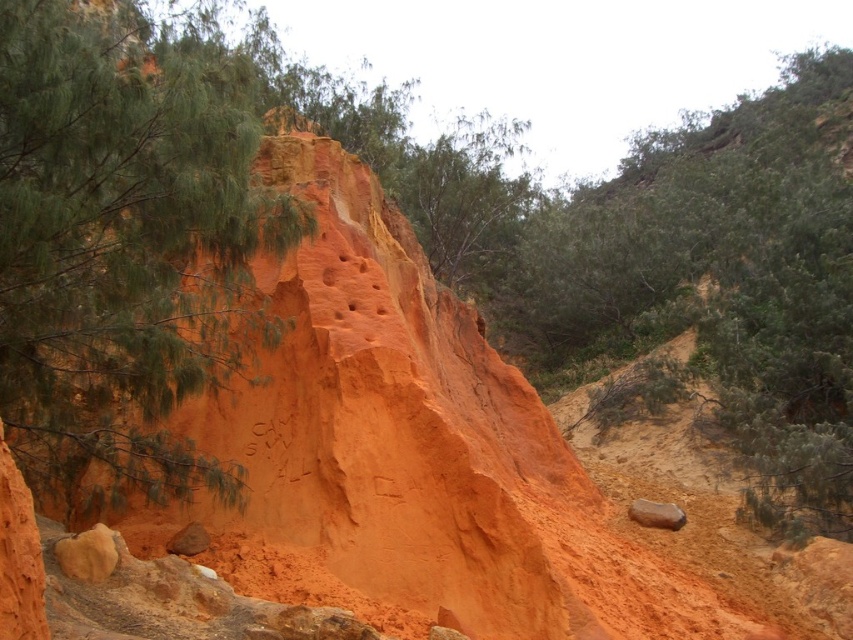
You are standing in front of the orange rock formation and notice two points marked on the cliff face. The first point is at coordinates point (828, 515) and the second is at point (664, 513). Which of these points is nearer to your current position?

Point (828, 515) is closer to the viewer than point (664, 513), so the first point is nearer to your current position.

You are standing in the natural landscape with the orange rock formation. You notice a point marked at coordinates (x=125, y=241). Which object in the scene does this point belong to?

The point at coordinates (x=125, y=241) is located on the green leafy tree at upper left.

You are an artist sketching this scene. You want to ensure the green leafy tree at upper left and the smooth brown rock at lower right are proportionally accurate. Which object should you draw wider in your sketch?

The green leafy tree at upper left should be drawn wider in your sketch since its width is larger than the smooth brown rock at lower right.